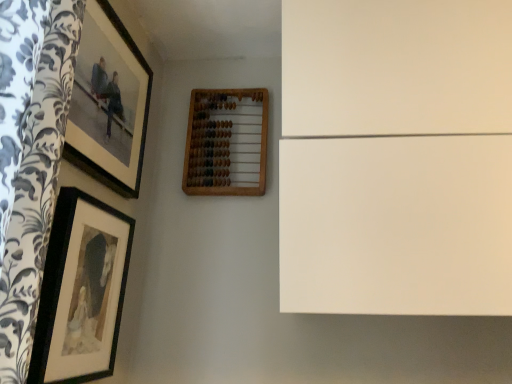
This screenshot has width=512, height=384. What do you see at coordinates (126, 126) in the screenshot?
I see `matte black picture frame at upper left` at bounding box center [126, 126].

I want to click on matte black picture frame at upper left, so click(126, 126).

At what (x,y) coordinates should I click in order to perform the action: click on matte black picture frame at upper left. Please return your answer as a coordinate pair (x, y). Looking at the image, I should click on (126, 126).